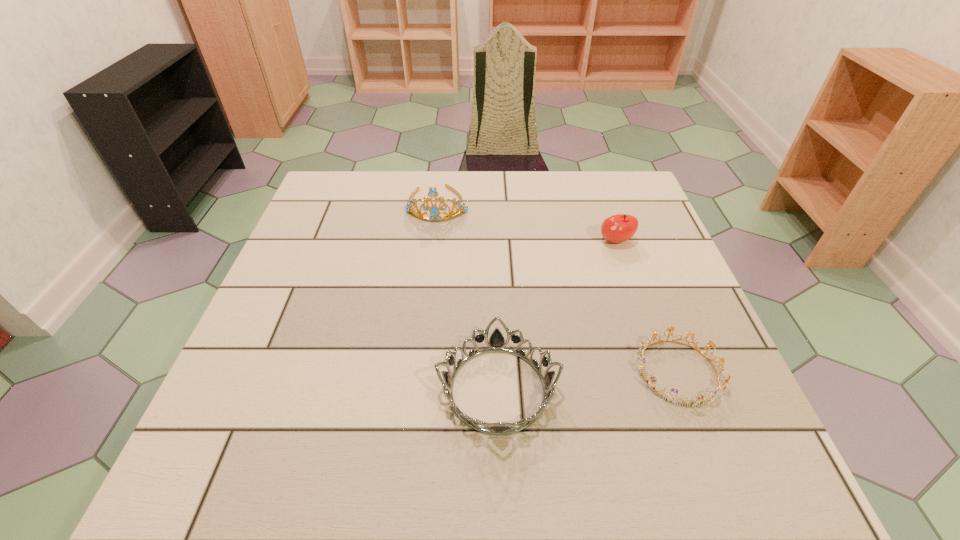
Where is `object that can be found as the second closest to the second shortest object`? object that can be found as the second closest to the second shortest object is located at coordinates (618, 228).

The width and height of the screenshot is (960, 540). I want to click on tiara that is the second closest to the shortest tiara, so (434, 212).

Identify which tiara is the second nearest to the shortest tiara. Please provide its 2D coordinates. Your answer should be formatted as a tuple, i.e. [(x, y)], where the tuple contains the x and y coordinates of a point satisfying the conditions above.

[(434, 212)]